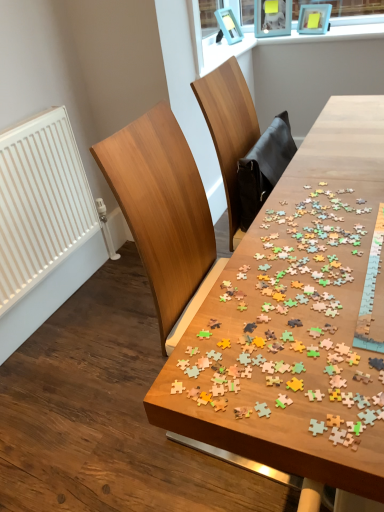
What do you see at coordinates (40, 202) in the screenshot?
I see `white matte radiator at left` at bounding box center [40, 202].

At what (x,y) coordinates should I click in order to perform the action: click on white matte radiator at left. Please return your answer as a coordinate pair (x, y). This screenshot has width=384, height=512. Looking at the image, I should click on (40, 202).

In order to face white matte radiator at left, should I rotate leftwards or rightwards?

Rotate left and turn 19.855 degrees.

What do you see at coordinates (294, 318) in the screenshot?
I see `wooden puzzle pieces at center` at bounding box center [294, 318].

In order to click on wooden puzzle pieces at center in this screenshot , I will do `click(294, 318)`.

Measure the distance between point (295, 322) and camera.

Point (295, 322) and camera are 71.10 centimeters apart.

You are a GUI agent. You are given a task and a screenshot of the screen. Output one action in this format:
    pyautogui.click(x=<x>, y=<y>)
    Task: Click on the white matte radiator at left
    This screenshot has height=512, width=384.
    Given the screenshot: What is the action you would take?
    pyautogui.click(x=40, y=202)

Between wooden puzzle pieces at center and white matte radiator at left, which one appears on the left side from the viewer's perspective?

Positioned to the left is white matte radiator at left.

Is wooden puzzle pieces at center in front of or behind white matte radiator at left in the image?

wooden puzzle pieces at center is positioned closer to the viewer than white matte radiator at left.

Is point (298, 225) closer to camera compared to point (78, 224)?

Yes, point (298, 225) is closer to viewer.

From the image's perspective, is wooden puzzle pieces at center above white matte radiator at left?

Incorrect, from the image's perspective, wooden puzzle pieces at center is lower than white matte radiator at left.

From a real-world perspective, is wooden puzzle pieces at center positioned above or below white matte radiator at left?

wooden puzzle pieces at center is situated lower than white matte radiator at left in the real world.

Which object is thinner, wooden puzzle pieces at center or white matte radiator at left?

With smaller width is white matte radiator at left.

Between wooden puzzle pieces at center and white matte radiator at left, which one has less height?

wooden puzzle pieces at center is shorter.

Based on their sizes in the image, would you say wooden puzzle pieces at center is bigger or smaller than white matte radiator at left?

In the image, wooden puzzle pieces at center appears to be larger than white matte radiator at left.

Do you think wooden puzzle pieces at center is within white matte radiator at left, or outside of it?

wooden puzzle pieces at center cannot be found inside white matte radiator at left.

From the picture: Is wooden puzzle pieces at center directly adjacent to white matte radiator at left?

They are not placed beside each other.

In the scene shown: Is wooden puzzle pieces at center oriented towards white matte radiator at left?

No, wooden puzzle pieces at center is not turned towards white matte radiator at left.

How different are the orientations of wooden puzzle pieces at center and white matte radiator at left in degrees?

They differ by 89.2 degrees in their facing directions.

Measure the distance between wooden puzzle pieces at center and white matte radiator at left.

wooden puzzle pieces at center is 1.14 meters from white matte radiator at left.

Locate an element on the screen. radiator on the left side of wooden puzzle pieces at center is located at coordinates (40, 202).

Is white matte radiator at left at the right side of wooden puzzle pieces at center?

Incorrect, white matte radiator at left is not on the right side of wooden puzzle pieces at center.

Which is behind, white matte radiator at left or wooden puzzle pieces at center?

white matte radiator at left is more distant.

Is point (18, 205) closer or farther from the camera than point (276, 305)?

Point (18, 205) is farther from the camera than point (276, 305).

From the image's perspective, between white matte radiator at left and wooden puzzle pieces at center, which one is located above?

white matte radiator at left, from the image's perspective.

From a real-world perspective, between white matte radiator at left and wooden puzzle pieces at center, who is vertically higher?

white matte radiator at left.

Can you confirm if white matte radiator at left is thinner than wooden puzzle pieces at center?

Yes.

In terms of height, does white matte radiator at left look taller or shorter compared to wooden puzzle pieces at center?

In the image, white matte radiator at left appears to be taller than wooden puzzle pieces at center.

Who is smaller, white matte radiator at left or wooden puzzle pieces at center?

white matte radiator at left.

Is white matte radiator at left outside of wooden puzzle pieces at center?

Absolutely, white matte radiator at left is external to wooden puzzle pieces at center.

Would you say white matte radiator at left is a long distance from wooden puzzle pieces at center?

Yes, white matte radiator at left is far from wooden puzzle pieces at center.

Is white matte radiator at left oriented towards wooden puzzle pieces at center?

Yes, white matte radiator at left is facing wooden puzzle pieces at center.

How different are the orientations of white matte radiator at left and wooden puzzle pieces at center in degrees?

89.2 degrees separate the facing orientations of white matte radiator at left and wooden puzzle pieces at center.

How much distance is there between white matte radiator at left and wooden puzzle pieces at center?

A distance of 1.14 meters exists between white matte radiator at left and wooden puzzle pieces at center.

At what (x,y) coordinates should I click in order to perform the action: click on radiator located above the wooden puzzle pieces at center (from a real-world perspective). Please return your answer as a coordinate pair (x, y). The width and height of the screenshot is (384, 512). Looking at the image, I should click on (40, 202).

Identify the location of table that appears in front of the white matte radiator at left. This screenshot has width=384, height=512. (294, 318).

Find the location of a particular element. The image size is (384, 512). radiator above the wooden puzzle pieces at center (from a real-world perspective) is located at coordinates (40, 202).